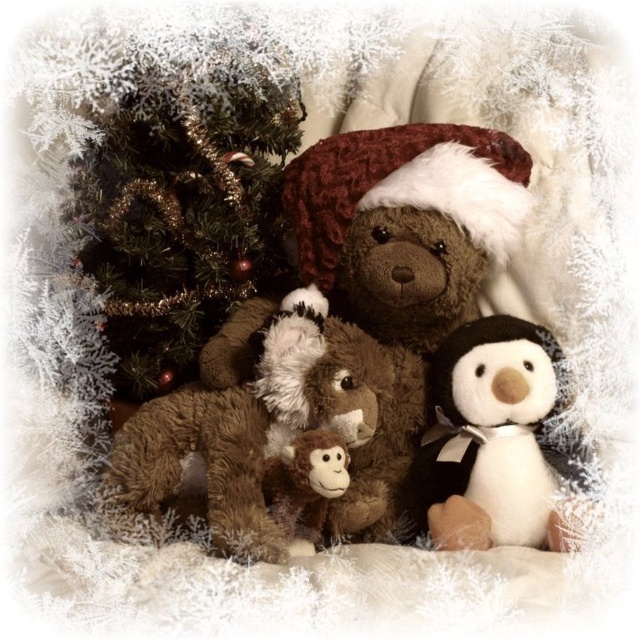
Question: Does brown plush teddy bear at center lie in front of brown plush monkey at center?

Choices:
 (A) yes
 (B) no

Answer: (A)

Question: Does brown plush teddy bear at center appear under fuzzy brown bear at center?

Choices:
 (A) no
 (B) yes

Answer: (B)

Question: Does white plush penguin at center have a lesser width compared to brown plush monkey at center?

Choices:
 (A) no
 (B) yes

Answer: (A)

Question: Which point is closer to the camera taking this photo?

Choices:
 (A) (376, 170)
 (B) (182, 404)
 (C) (438, 483)

Answer: (A)

Question: Which of the following is the closest to the observer?

Choices:
 (A) (212, 449)
 (B) (348, 460)

Answer: (B)

Question: Estimate the real-world distances between objects in this image. Which object is farther from the brown plush monkey at center?

Choices:
 (A) white plush penguin at center
 (B) fuzzy brown bear at center

Answer: (B)